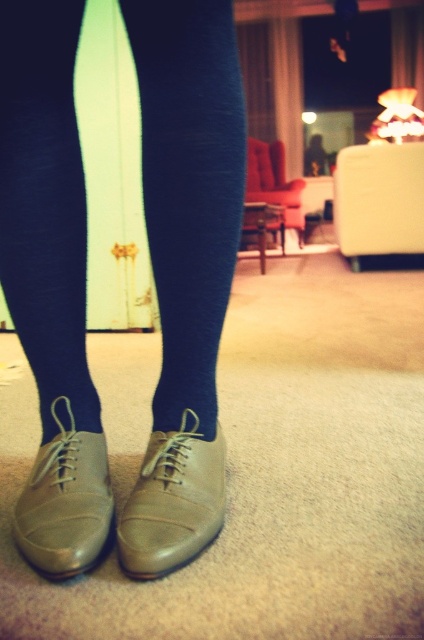
You are a photographer setting up a shoot in the scene described. You need to position a small prop between the blue tights at center and the matte leather shoe at lower center. Based on their positions, on which side of the shoe should you place the prop?

The blue tights at center is to the right of the matte leather shoe at lower center, so the prop should be placed to the right side of the matte leather shoe at lower center.

You are trying to decide which item to pack first for your trip. You have the blue tights at center and the matte leather shoe at lower center in your suitcase. Which item takes up more horizontal space when placed side by side?

The blue tights at center takes up more horizontal space than the matte leather shoe at lower center because its width surpasses the shoe.

You are arranging a photo shoot and need to ensure proper lighting on both the blue tights at center and the matte leather shoe at center. Since the lamp is casting light from the left, which object might receive more even illumination? Please explain based on their positions.

The blue tights at center are positioned to the left of the matte leather shoe at center. Since the lamp is casting light from the left, the blue tights at center would receive more even illumination as they are closer to the light source compared to the matte leather shoe at center.